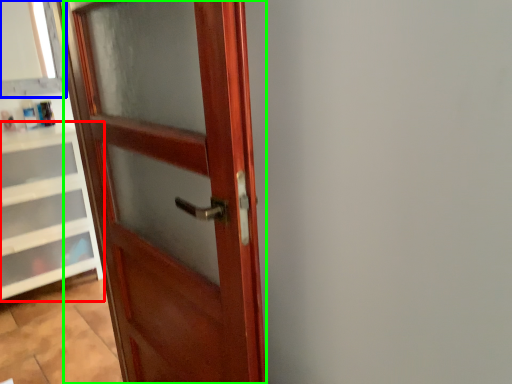
Question: Considering the real-world distances, which object is farthest from cabinetry (highlighted by a red box)? window frame (highlighted by a blue box) or door (highlighted by a green box)?

Choices:
 (A) window frame
 (B) door

Answer: (B)